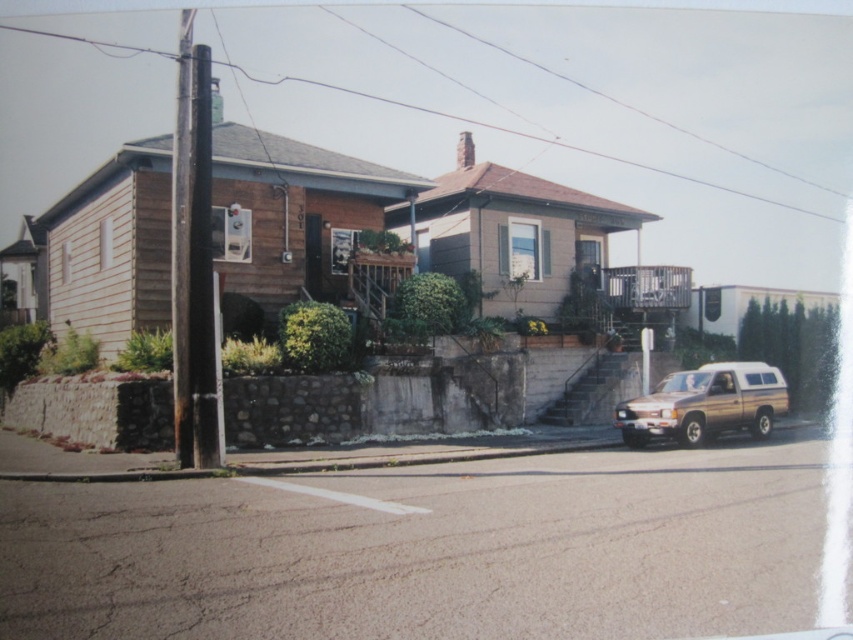
You are standing on the residential street and want to take a photo of both points mentioned. Which point, point [619,413] or point [700,179], will appear larger in your camera view?

→ Point [619,413] will appear larger in the camera view because it is closer to the camera than point [700,179].